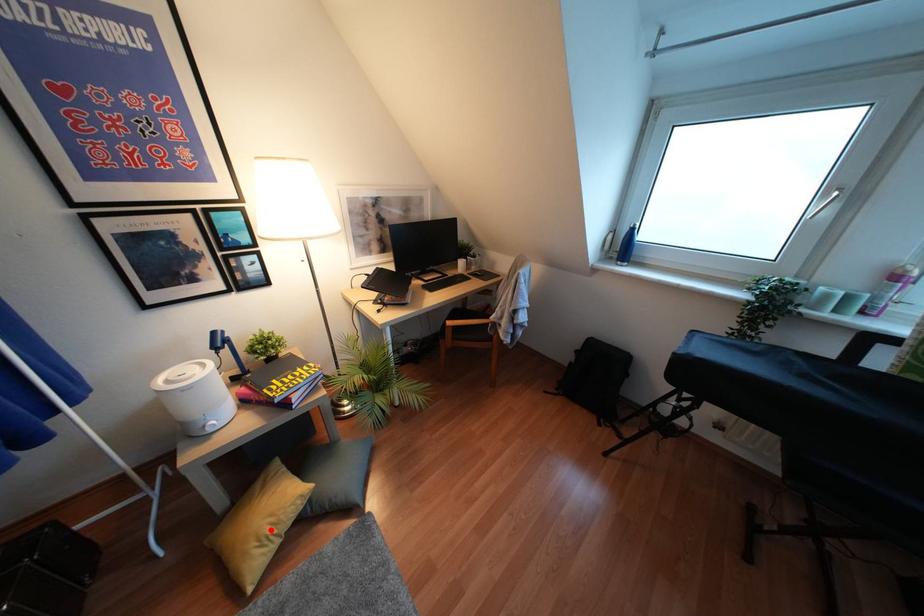
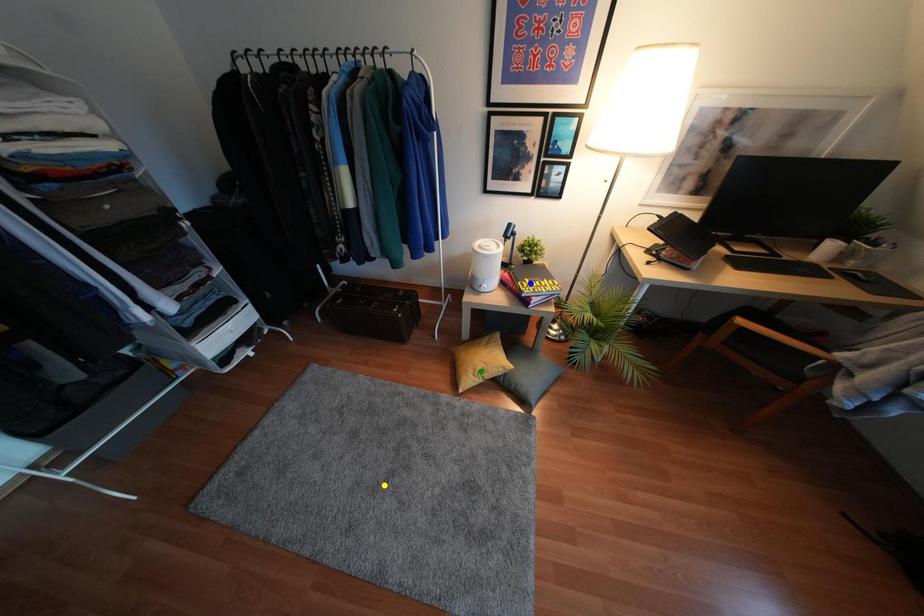
Question: I am providing you with two images of the same scene from different viewpoints. A red point is marked on the first image. You are given multiple points on the second image. Which point in image 2 represents the same 3d spot as the red point in image 1?

Choices:
 (A) blue point
 (B) yellow point
 (C) green point

Answer: (C)